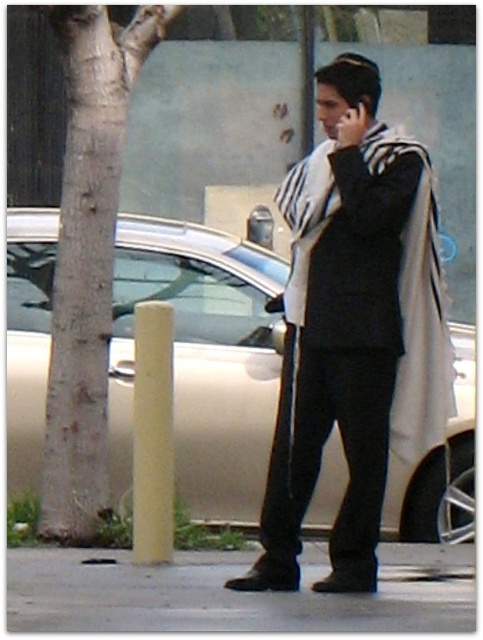
You are a delivery person who needs to place a small package on the ground near the striped wool scarf at center without stepping off the gray concrete sidewalk at lower center. Can you do this?

The striped wool scarf at center and gray concrete sidewalk at lower center are 38.73 inches apart. Since the distance is within reach while standing on the sidewalk, you can place the package near the scarf without leaving the sidewalk.

You are a delivery person who needs to deliver a package to the address located at the gray bark tree at left. The GPS shows the point at coordinates (x=87, y=253). Can you confirm if this point corresponds to the gray bark tree at left?

Yes, the point at coordinates (x=87, y=253) corresponds to the gray bark tree at left as stated in the description.

You are a delivery person who needs to place a package on the sidewalk. The package has a label that says it must be placed on the gray concrete sidewalk at lower center. However, there is a striped wool scarf at center in the way. Where should you place the package so it doesn work interfere with the scarf?

The striped wool scarf at center is above the gray concrete sidewalk at lower center, so you should place the package on the gray concrete sidewalk at lower center below the striped wool scarf at center to avoid interference.